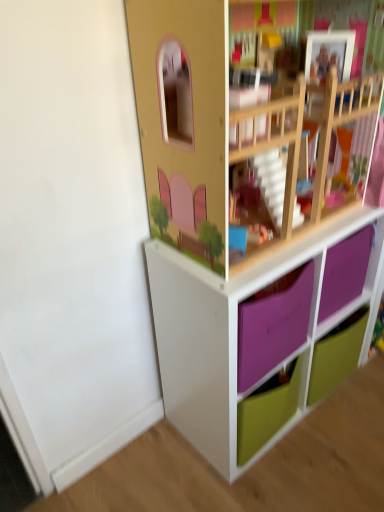
Find the location of `space that is in front of white matte storage unit at lower right`. space that is in front of white matte storage unit at lower right is located at coordinates (296, 473).